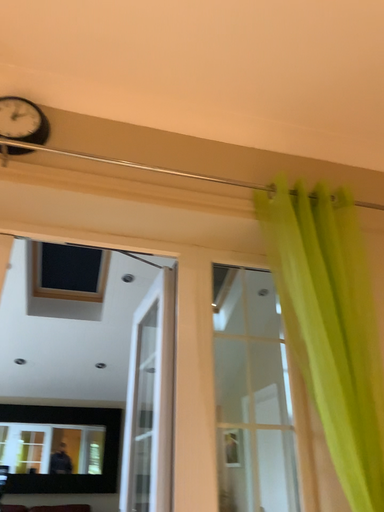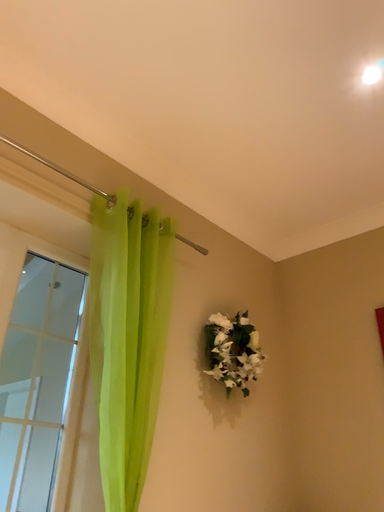
Question: Which way did the camera rotate in the video?

Choices:
 (A) rotated right
 (B) rotated left

Answer: (A)